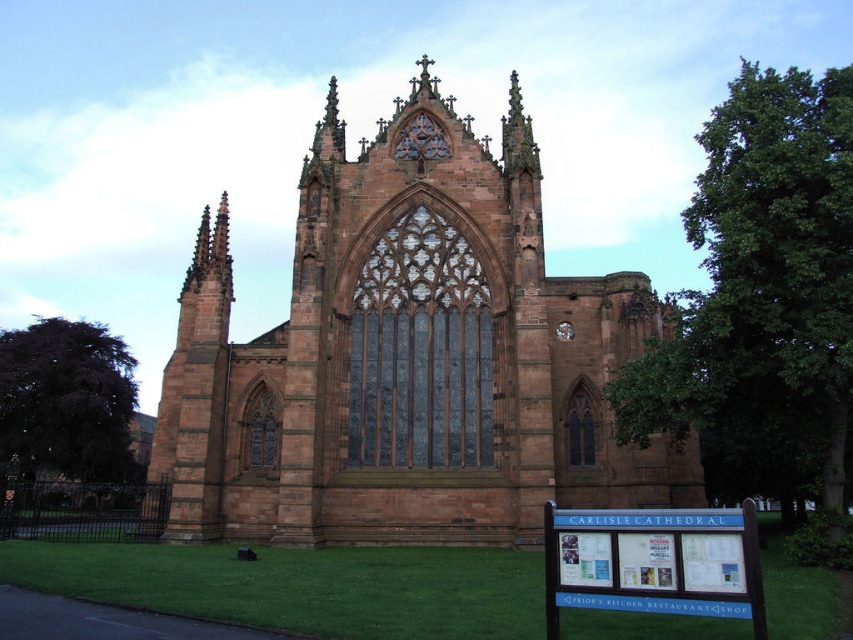
Question: Which object appears farthest from the camera in this image?

Choices:
 (A) blue plastic sign at lower right
 (B) green grass at lower center
 (C) brown stone church at center

Answer: (C)

Question: Which object is the closest to the blue plastic sign at lower right?

Choices:
 (A) brown stone church at center
 (B) green grass at lower center

Answer: (B)

Question: Does brown stone church at center have a lesser width compared to blue plastic sign at lower right?

Choices:
 (A) yes
 (B) no

Answer: (B)

Question: Which point is closer to the camera?

Choices:
 (A) (287, 458)
 (B) (636, 564)

Answer: (B)

Question: Is brown stone church at center to the left of green grass at lower center from the viewer's perspective?

Choices:
 (A) no
 (B) yes

Answer: (A)

Question: Does brown stone church at center have a lesser width compared to blue plastic sign at lower right?

Choices:
 (A) yes
 (B) no

Answer: (B)